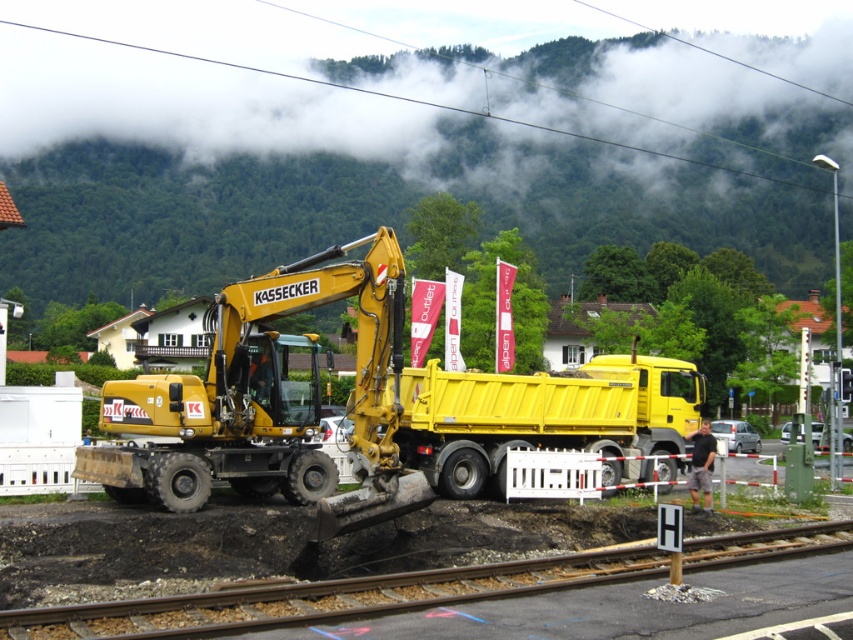
You are a safety inspector at the construction site. You need to ensure that the yellow rubber excavator at center is not blocking the smooth asphalt track at lower center. Based on the scene description, is the excavator positioned in a way that it is not obstructing the track?

The smooth asphalt track at lower center is behind the yellow rubber excavator at center, so the excavator is not blocking the track since it is positioned in front of it.

You are standing at the camera position observing the construction site. There is a point marked at coordinates point (242,284). Can you safely walk to that point without crossing any barriers? Please explain your reasoning.

The point (242,284) is 14.61 meters away from the camera. However, the construction site is fenced off with white barriers and red and white striped tape, which restrict access. Therefore, you cannot safely walk to that point without crossing the barriers.